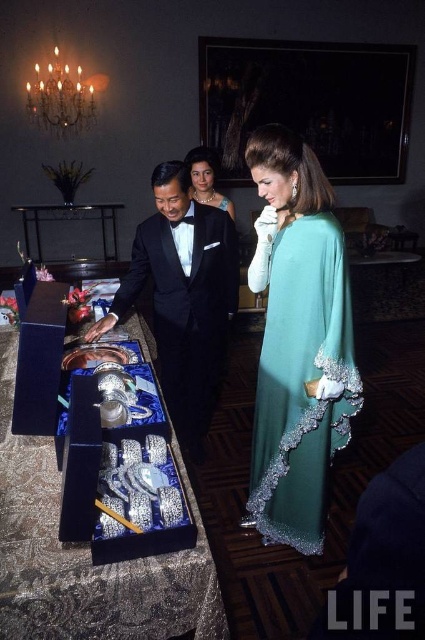
You are a photographer at a formal event and need to capture both the black satin tuxedo at center and the matte black dress at center in a single frame. Given their sizes, which one should you focus on to ensure both fit in the photo without cropping?

The black satin tuxedo at center is bigger than the matte black dress at center, so you should focus on the black satin tuxedo at center to ensure both fit in the photo without cropping.

You are a photographer at a formal event and need to capture both the black satin tuxedo at center and the matte black dress at center in a single frame. Which one should you adjust your camera angle to focus on first to ensure both are in the frame?

The black satin tuxedo at center is taller than the matte black dress at center, so you should focus on the black satin tuxedo at center first to ensure the camera angle accommodates its height, allowing the shorter matte black dress at center to naturally fit into the frame as well.

You are a guest at this event and need to place a small gift on the shiny silver tray at center. However, there is also a matte black dress at center nearby. Which object is shorter so that the gift can be placed without obstruction?

The shiny silver tray at center is not as tall as the matte black dress at center, so the gift can be placed on the shiny silver tray at center without obstruction.